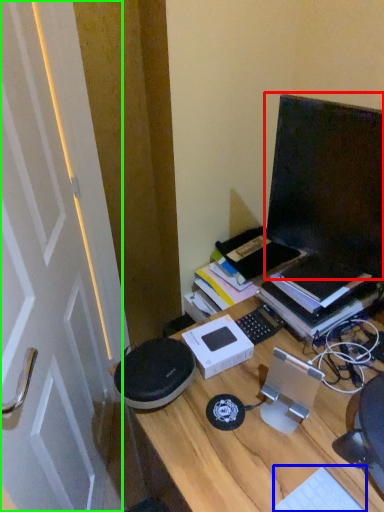
Question: Considering the real-world distances, which object is closest to computer monitor (highlighted by a red box)? computer keyboard (highlighted by a blue box) or door (highlighted by a green box).

Choices:
 (A) computer keyboard
 (B) door

Answer: (A)